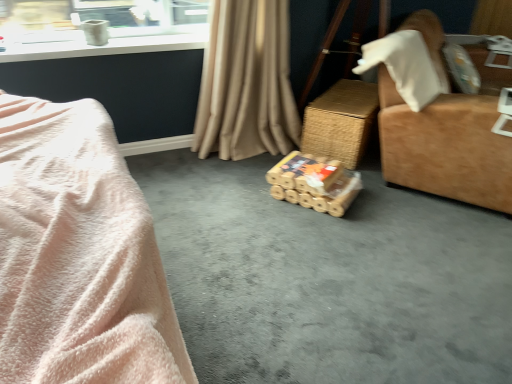
Where is `vacant space to the left of bamboo-textured toy at center`? The image size is (512, 384). vacant space to the left of bamboo-textured toy at center is located at coordinates (243, 196).